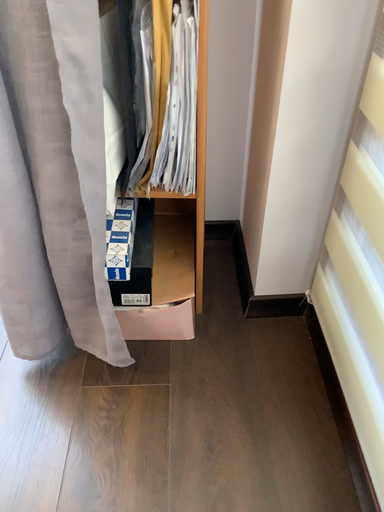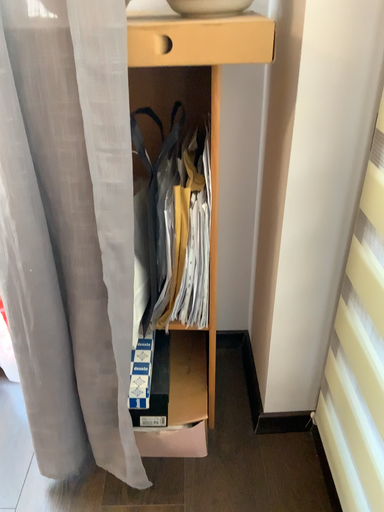
Question: Which way did the camera rotate in the video?

Choices:
 (A) rotated downward
 (B) rotated upward

Answer: (B)